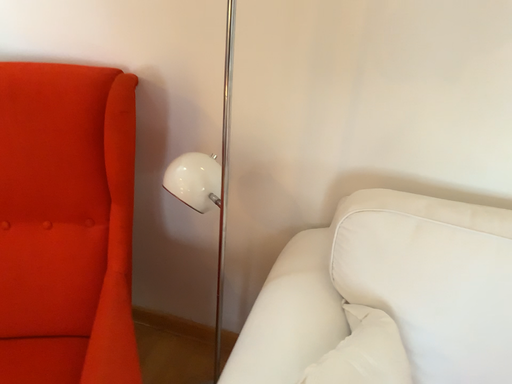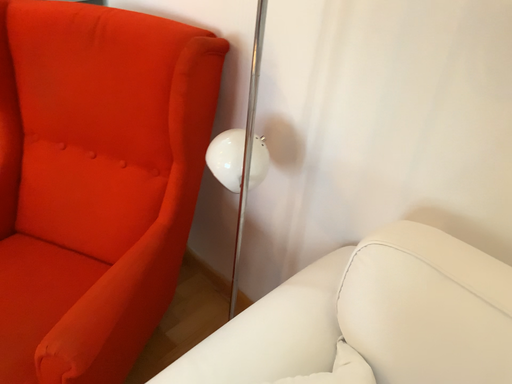
Question: How did the camera likely rotate when shooting the video?

Choices:
 (A) rotated right
 (B) rotated left

Answer: (B)